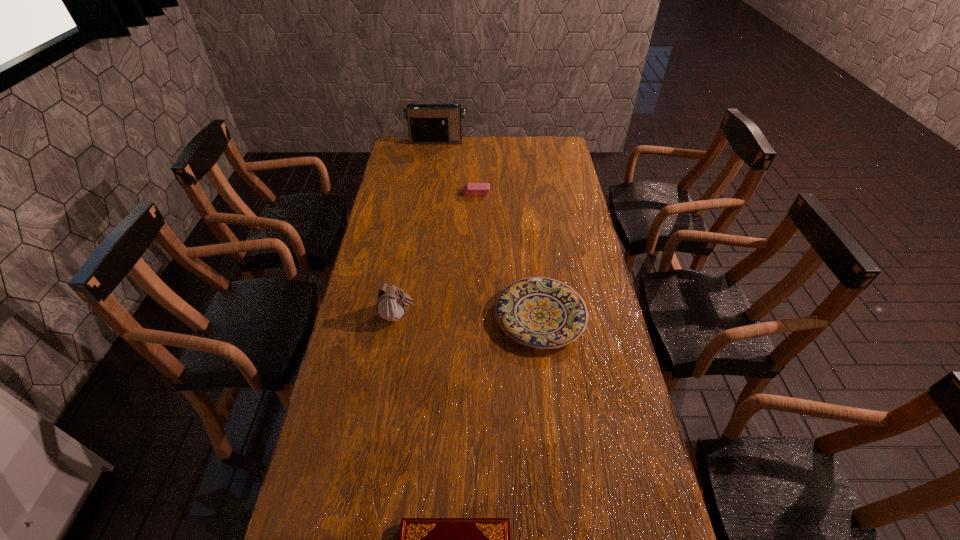
Where is `empty space between the pouch and the farthest object`? The height and width of the screenshot is (540, 960). empty space between the pouch and the farthest object is located at coordinates (418, 228).

This screenshot has width=960, height=540. In order to click on vacant area that lies between the pouch and the eraser in this screenshot , I will do `click(438, 254)`.

Image resolution: width=960 pixels, height=540 pixels. I want to click on vacant space that is in between the radio receiver and the plate, so pos(489,228).

The width and height of the screenshot is (960, 540). What are the coordinates of `vacant area that lies between the plate and the radio receiver` in the screenshot? It's located at (489, 228).

Where is `object that stands as the closest to the nearest object`? The height and width of the screenshot is (540, 960). object that stands as the closest to the nearest object is located at coordinates (543, 313).

Where is `the second closest object relative to the pouch`? This screenshot has width=960, height=540. the second closest object relative to the pouch is located at coordinates (421, 539).

Identify the location of free space that satisfies the following two spatial constraints: 1. on the front-facing side of the tallest object; 2. on the front-facing side of the pouch. The image size is (960, 540). (413, 315).

The image size is (960, 540). What are the coordinates of `vacant area that satisfies the following two spatial constraints: 1. on the front-facing side of the radio receiver; 2. on the left side of the eraser` in the screenshot? It's located at (429, 193).

Where is `free space that satisfies the following two spatial constraints: 1. on the front-facing side of the second farthest object; 2. on the left side of the tallest object`? free space that satisfies the following two spatial constraints: 1. on the front-facing side of the second farthest object; 2. on the left side of the tallest object is located at coordinates (429, 193).